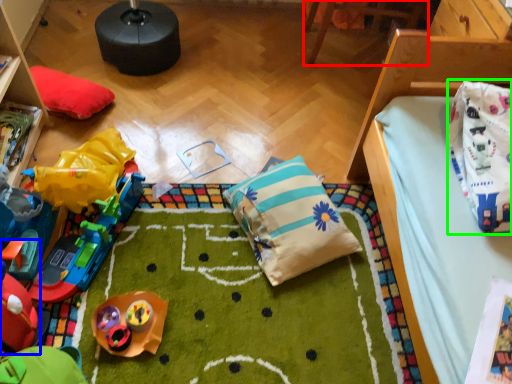
Question: Considering the real-world distances, which object is closest to furniture (highlighted by a red box)? toy (highlighted by a blue box) or material (highlighted by a green box).

Choices:
 (A) toy
 (B) material

Answer: (B)